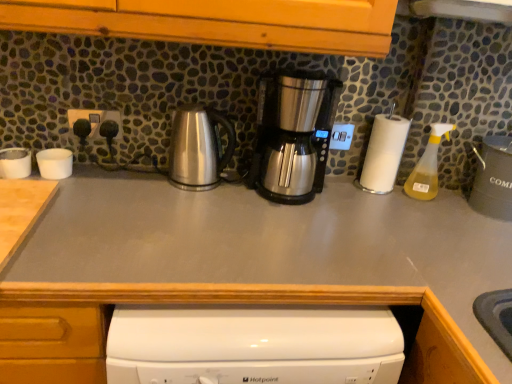
I want to click on white paper towel at right, so click(383, 153).

Image resolution: width=512 pixels, height=384 pixels. I want to click on satin silver outlet at upper center, so click(95, 120).

What is the approximate height of matte gray canister at right, which appears as the first appliance when viewed from the right?

The height of matte gray canister at right, which appears as the first appliance when viewed from the right, is 8.51 inches.

Image resolution: width=512 pixels, height=384 pixels. Describe the element at coordinates (493, 179) in the screenshot. I see `matte gray canister at right, the third appliance positioned from the left` at that location.

Describe the element at coordinates (198, 148) in the screenshot. Image resolution: width=512 pixels, height=384 pixels. I see `satin silver kettle at center, marked as the 2th kitchen appliance in a right-to-left arrangement` at that location.

Where is `white paper towel at right`? The width and height of the screenshot is (512, 384). white paper towel at right is located at coordinates tap(383, 153).

From the image's perspective, is gray matte countertop at left positioned above or below white paper towel at right?

gray matte countertop at left is situated lower than white paper towel at right in the image.

From a real-world perspective, is gray matte countertop at left positioned under white paper towel at right based on gravity?

Yes, from a real-world perspective, gray matte countertop at left is beneath white paper towel at right.

Is gray matte countertop at left far away from white paper towel at right?

That's not correct — gray matte countertop at left is a little close to white paper towel at right.

Which of these two, satin silver outlet at upper center or white paper towel at right, is bigger?

With larger size is white paper towel at right.

Locate an element on the screen. electric outlet lying on the left of white paper towel at right is located at coordinates (95, 120).

Is satin silver outlet at upper center in front of white paper towel at right?

No, it is not.

Is white paper towel at right located within satin silver outlet at upper center?

No, white paper towel at right is not inside satin silver outlet at upper center.

Is white plastic cups at left, arranged as the first appliance when viewed from the left, taller or shorter than white matte cups at left, which is counted as the 2th appliance, starting from the left?

white plastic cups at left, arranged as the first appliance when viewed from the left, is shorter than white matte cups at left, which is counted as the 2th appliance, starting from the left.

From a real-world perspective, is white plastic cups at left, arranged as the first appliance when viewed from the left, positioned under white matte cups at left, arranged as the 2th appliance when viewed from the right, based on gravity?

Indeed, from a real-world perspective, white plastic cups at left, arranged as the first appliance when viewed from the left, is positioned beneath white matte cups at left, arranged as the 2th appliance when viewed from the right.

Is white plastic cups at left, arranged as the first appliance when viewed from the left, turned away from white matte cups at left, which is counted as the 2th appliance, starting from the left?

No, white plastic cups at left, arranged as the first appliance when viewed from the left, is not facing away from white matte cups at left, which is counted as the 2th appliance, starting from the left.

Is white matte cups at left, arranged as the 2th appliance when viewed from the right, completely or partially inside white plastic cups at left, arranged as the first appliance when viewed from the left?

No, white matte cups at left, arranged as the 2th appliance when viewed from the right, is not surrounded by white plastic cups at left, arranged as the first appliance when viewed from the left.

Which object is wider, satin silver outlet at upper center or stainless steel coffee maker at center, acting as the first kitchen appliance starting from the right?

stainless steel coffee maker at center, acting as the first kitchen appliance starting from the right, is wider.

Does satin silver outlet at upper center appear on the right side of stainless steel coffee maker at center, marked as the 2th kitchen appliance in a left-to-right arrangement?

No.

Is satin silver outlet at upper center aimed at stainless steel coffee maker at center, marked as the 2th kitchen appliance in a left-to-right arrangement?

No, satin silver outlet at upper center is not facing towards stainless steel coffee maker at center, marked as the 2th kitchen appliance in a left-to-right arrangement.

Is satin silver outlet at upper center in contact with stainless steel coffee maker at center, marked as the 2th kitchen appliance in a left-to-right arrangement?

They are not placed beside each other.

Does white paper towel at right appear on the right side of matte gray canister at right, which appears as the first appliance when viewed from the right?

In fact, white paper towel at right is to the left of matte gray canister at right, which appears as the first appliance when viewed from the right.

Is white paper towel at right aimed at matte gray canister at right, the third appliance positioned from the left?

No, white paper towel at right is not turned towards matte gray canister at right, the third appliance positioned from the left.

Considering the relative sizes of white paper towel at right and matte gray canister at right, the third appliance positioned from the left, in the image provided, is white paper towel at right thinner than matte gray canister at right, the third appliance positioned from the left,?

Correct, the width of white paper towel at right is less than that of matte gray canister at right, the third appliance positioned from the left.

Is white paper towel at right inside or outside of matte gray canister at right, which appears as the first appliance when viewed from the right?

white paper towel at right exists outside the volume of matte gray canister at right, which appears as the first appliance when viewed from the right.

Is satin silver outlet at upper center next to white matte cups at left, which is counted as the 2th appliance, starting from the left?

No, satin silver outlet at upper center is not beside white matte cups at left, which is counted as the 2th appliance, starting from the left.

Is white matte cups at left, which is counted as the 2th appliance, starting from the left, a part of satin silver outlet at upper center?

No.

From the image's perspective, would you say satin silver outlet at upper center is positioned over white matte cups at left, arranged as the 2th appliance when viewed from the right?

Yes, from the image's perspective, satin silver outlet at upper center is above white matte cups at left, arranged as the 2th appliance when viewed from the right.

Could you tell me if satin silver outlet at upper center is turned towards white matte cups at left, arranged as the 2th appliance when viewed from the right?

No.

From the picture: Is satin silver outlet at upper center not within yellow translucent spray bottle at right?

satin silver outlet at upper center lies outside yellow translucent spray bottle at right's area.

In terms of width, does satin silver outlet at upper center look wider or thinner when compared to yellow translucent spray bottle at right?

In the image, satin silver outlet at upper center appears to be more narrow than yellow translucent spray bottle at right.

In terms of height, does satin silver outlet at upper center look taller or shorter compared to yellow translucent spray bottle at right?

In the image, satin silver outlet at upper center appears to be shorter than yellow translucent spray bottle at right.

How different are the orientations of satin silver outlet at upper center and yellow translucent spray bottle at right in degrees?

0.0296 degrees.

You are a GUI agent. You are given a task and a screenshot of the screen. Output one action in this format:
    pyautogui.click(x=<x>, y=<y>)
    Task: Click on the paper towel on the right of the gray matte countertop at left
    
    Given the screenshot: What is the action you would take?
    pyautogui.click(x=383, y=153)

Locate an element on the screen. The image size is (512, 384). electric outlet above the white paper towel at right (from the image's perspective) is located at coordinates (95, 120).

When comparing their distances from white matte cups at left, arranged as the 2th appliance when viewed from the right, does white paper towel at right or gray matte countertop at center seem closer?

gray matte countertop at center is positioned closer to the anchor white matte cups at left, arranged as the 2th appliance when viewed from the right.

Which object lies further to the anchor point gray matte countertop at left, satin silver kettle at center, marked as the 2th kitchen appliance in a right-to-left arrangement, or stainless steel coffee maker at center, acting as the first kitchen appliance starting from the right?

The object further to gray matte countertop at left is stainless steel coffee maker at center, acting as the first kitchen appliance starting from the right.

Estimate the real-world distances between objects in this image. Which object is closer to white matte cups at left, which is counted as the 2th appliance, starting from the left, satin silver outlet at upper center or gray matte countertop at center?

satin silver outlet at upper center lies closer to white matte cups at left, which is counted as the 2th appliance, starting from the left, than the other object.

Which object lies nearer to the anchor point white paper towel at right, satin silver outlet at upper center or satin silver kettle at center, marked as the 2th kitchen appliance in a right-to-left arrangement?

satin silver kettle at center, marked as the 2th kitchen appliance in a right-to-left arrangement, is closer to white paper towel at right.

Based on their spatial positions, is white plastic cups at left, arranged as the first appliance when viewed from the left, or satin silver outlet at upper center closer to white paper towel at right?

Among the two, satin silver outlet at upper center is located nearer to white paper towel at right.

Estimate the real-world distances between objects in this image. Which object is further from yellow translucent spray bottle at right, white matte cups at left, arranged as the 2th appliance when viewed from the right, or satin silver kettle at center, which ranks as the first kitchen appliance in left-to-right order?

Based on the image, white matte cups at left, arranged as the 2th appliance when viewed from the right, appears to be further to yellow translucent spray bottle at right.

Looking at the image, which one is located further to white plastic cups at left, arranged as the first appliance when viewed from the left, stainless steel coffee maker at center, acting as the first kitchen appliance starting from the right, or white matte cups at left, which is counted as the 2th appliance, starting from the left?

stainless steel coffee maker at center, acting as the first kitchen appliance starting from the right, is positioned further to the anchor white plastic cups at left, arranged as the first appliance when viewed from the left.

Looking at the image, which one is located closer to stainless steel coffee maker at center, acting as the first kitchen appliance starting from the right, gray matte countertop at center or yellow translucent spray bottle at right?

gray matte countertop at center lies closer to stainless steel coffee maker at center, acting as the first kitchen appliance starting from the right, than the other object.

Image resolution: width=512 pixels, height=384 pixels. Identify the location of paper towel between gray matte countertop at left and yellow translucent spray bottle at right. (383, 153).

Where is `bottle between gray matte countertop at center and matte gray canister at right, the third appliance positioned from the left, from left to right`? bottle between gray matte countertop at center and matte gray canister at right, the third appliance positioned from the left, from left to right is located at coordinates (428, 165).

This screenshot has height=384, width=512. What are the coordinates of `appliance between white plastic cups at left, arranged as the first appliance when viewed from the left, and gray matte countertop at center, in the horizontal direction` in the screenshot? It's located at (55, 163).

Locate an element on the screen. This screenshot has height=384, width=512. paper towel between satin silver kettle at center, which ranks as the first kitchen appliance in left-to-right order, and matte gray canister at right, which appears as the first appliance when viewed from the right, in the horizontal direction is located at coordinates (383, 153).